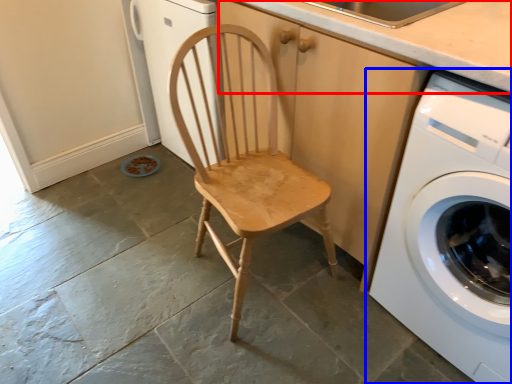
Question: Which object is further to the camera taking this photo, counter top (highlighted by a red box) or washing machine (highlighted by a blue box)?

Choices:
 (A) counter top
 (B) washing machine

Answer: (A)